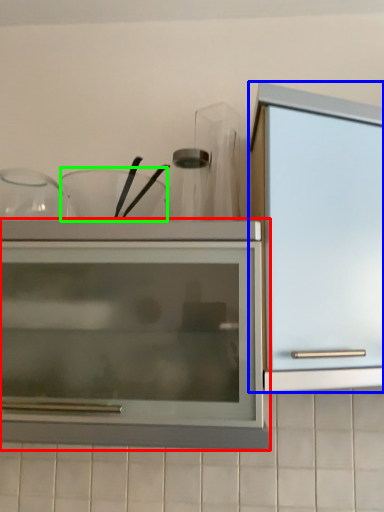
Question: Estimate the real-world distances between objects in this image. Which object is farther from cupboard (highlighted by a red box), cabinetry (highlighted by a blue box) or tableware (highlighted by a green box)?

Choices:
 (A) cabinetry
 (B) tableware

Answer: (B)